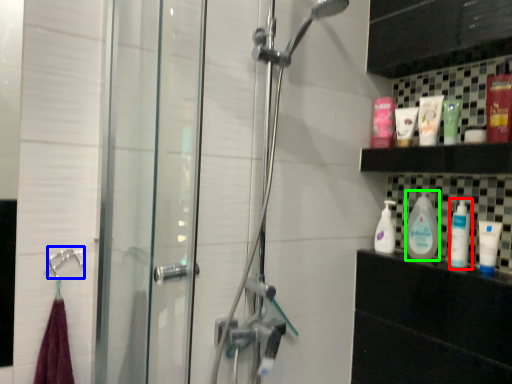
Question: Which object is the closest to the cleaning product (highlighted by a red box)? Choose among these: shower (highlighted by a blue box) or cleaning product (highlighted by a green box).

Choices:
 (A) shower
 (B) cleaning product

Answer: (B)